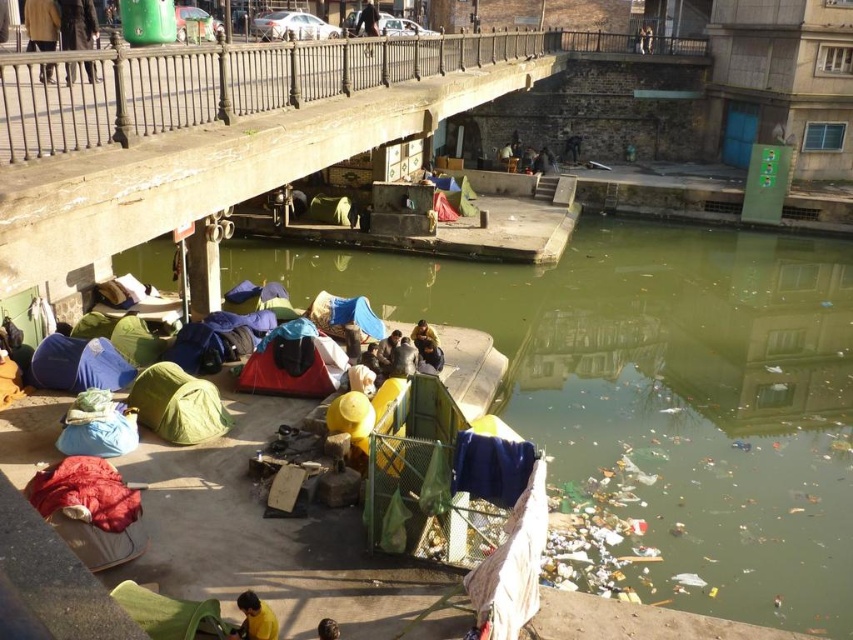
Is green murky water at lower center further to camera compared to dark brown leather jacket at upper left?

No, green murky water at lower center is closer to the viewer.

Locate an element on the screen. This screenshot has height=640, width=853. green murky water at lower center is located at coordinates (659, 400).

Find the location of a particular element. Image resolution: width=853 pixels, height=640 pixels. green murky water at lower center is located at coordinates tap(659, 400).

Which is below, yellow matte jacket at lower center or yellow fabric person at lower center?

Positioned lower is yellow fabric person at lower center.

The width and height of the screenshot is (853, 640). What do you see at coordinates (254, 618) in the screenshot?
I see `yellow matte jacket at lower center` at bounding box center [254, 618].

Identify the location of yellow matte jacket at lower center. (254, 618).

The height and width of the screenshot is (640, 853). What are the coordinates of `green murky water at lower center` in the screenshot? It's located at (659, 400).

Does green murky water at lower center have a lesser height compared to brown leather jacket at upper left?

No, green murky water at lower center is not shorter than brown leather jacket at upper left.

Who is more forward, (628,243) or (28,12)?

Point (28,12)

You are a GUI agent. You are given a task and a screenshot of the screen. Output one action in this format:
    pyautogui.click(x=<x>, y=<y>)
    Task: Click on the green murky water at lower center
    This screenshot has width=853, height=640.
    Given the screenshot: What is the action you would take?
    pyautogui.click(x=659, y=400)